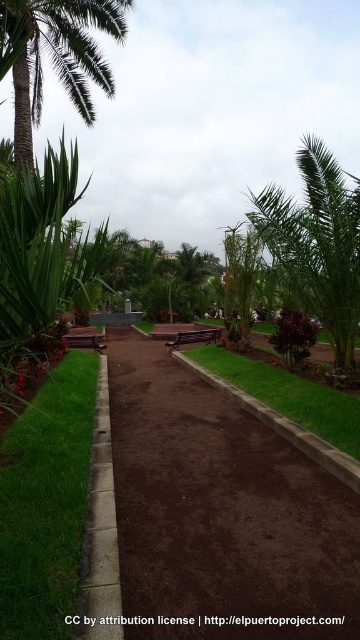
Is green leafy palm tree at upper right above green turf at center?

Indeed, green leafy palm tree at upper right is positioned over green turf at center.

Who is taller, green leafy palm tree at upper right or green turf at center?

Standing taller between the two is green leafy palm tree at upper right.

Locate an element on the screen. Image resolution: width=360 pixels, height=640 pixels. green leafy palm tree at upper right is located at coordinates (317, 243).

Is brown dirt path at center above green turf at center?

No, brown dirt path at center is not above green turf at center.

Can you confirm if brown dirt path at center is bigger than green turf at center?

Yes.

Locate an element on the screen. This screenshot has height=640, width=360. brown dirt path at center is located at coordinates coord(221,512).

Is brown dirt path at center in front of green leafy palm tree at upper right?

Yes, brown dirt path at center is in front of green leafy palm tree at upper right.

In the scene shown: Which is above, brown dirt path at center or green leafy palm tree at upper right?

green leafy palm tree at upper right is higher up.

What are the coordinates of `brown dirt path at center` in the screenshot? It's located at (221, 512).